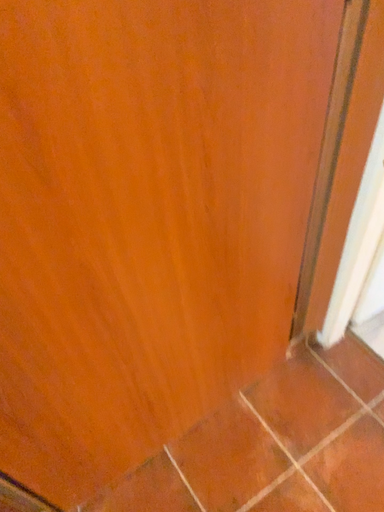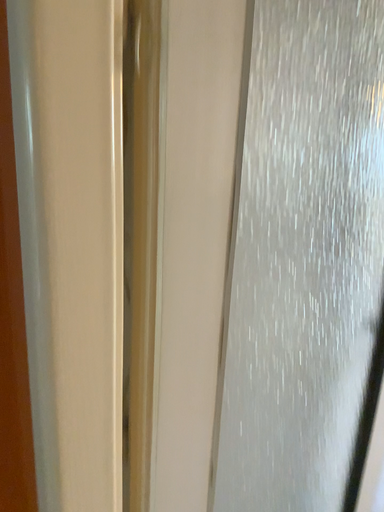
Question: Which way did the camera rotate in the video?

Choices:
 (A) rotated left
 (B) rotated right

Answer: (B)